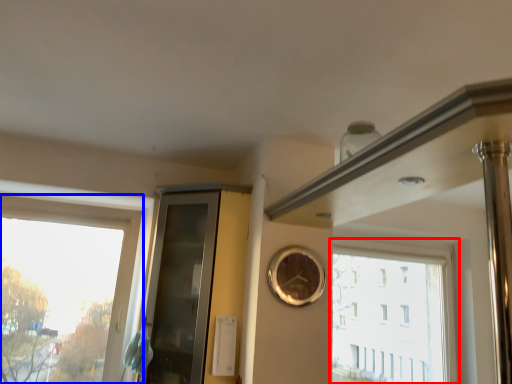
Question: Among these objects, which one is nearest to the camera, window (highlighted by a red box) or window (highlighted by a blue box)?

Choices:
 (A) window
 (B) window

Answer: (B)